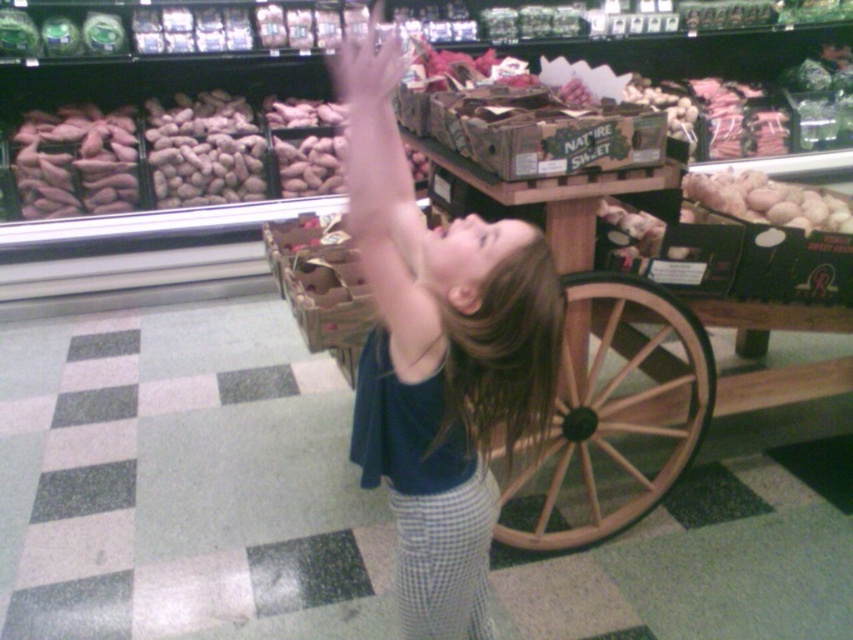
Does dark blue shirt at center have a lesser width compared to smooth beige potatoes at right?

Yes.

You are a GUI agent. You are given a task and a screenshot of the screen. Output one action in this format:
    pyautogui.click(x=<x>, y=<y>)
    Task: Click on the dark blue shirt at center
    This screenshot has height=640, width=853.
    Given the screenshot: What is the action you would take?
    pyautogui.click(x=444, y=374)

Identify the location of dark blue shirt at center. Image resolution: width=853 pixels, height=640 pixels. (444, 374).

Between dark blue shirt at center and pink matte potatoes at left, which one appears on the right side from the viewer's perspective?

From the viewer's perspective, dark blue shirt at center appears more on the right side.

Which is behind, point (370, 230) or point (90, 116)?

Point (90, 116)

Locate an element on the screen. The height and width of the screenshot is (640, 853). dark blue shirt at center is located at coordinates (444, 374).

Based on the photo, is smooth brown peanuts at upper left taller than smooth skin hand at upper center?

Yes.

Between smooth brown peanuts at upper left and smooth skin hand at upper center, which one has more height?

smooth brown peanuts at upper left

The height and width of the screenshot is (640, 853). In order to click on smooth brown peanuts at upper left in this screenshot , I will do `click(202, 150)`.

Identify the location of smooth brown peanuts at upper left. (202, 150).